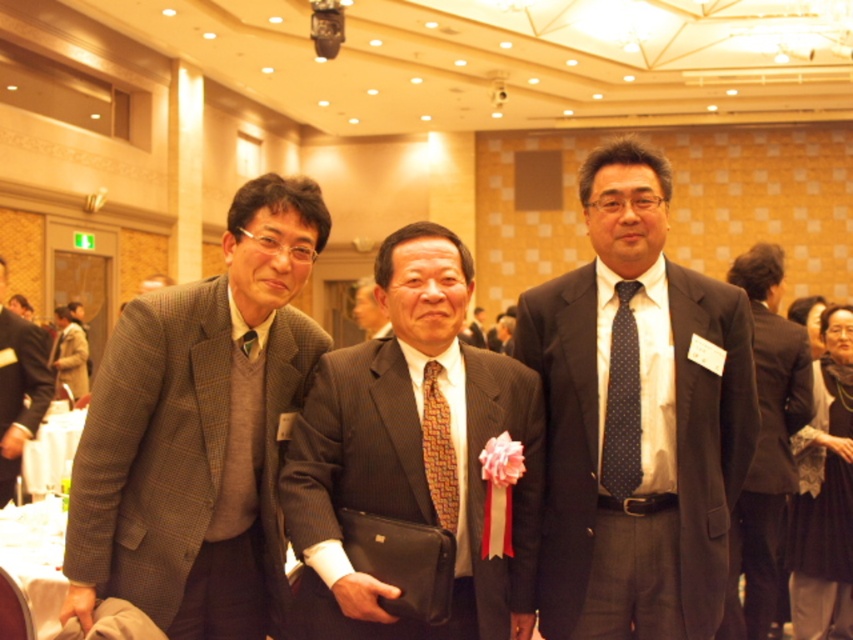
What are the coordinates of `brown pinstripe suit at center` in the screenshot? It's located at (413, 452).

Which is below, brown pinstripe suit at center or brown textured suit at center?

brown pinstripe suit at center is below.

The image size is (853, 640). I want to click on brown pinstripe suit at center, so click(x=413, y=452).

Between dark gray suit at center and dark blue dotted tie at center, which one is positioned lower?

dark blue dotted tie at center

Between dark gray suit at center and dark blue dotted tie at center, which one is positioned higher?

dark gray suit at center is higher up.

Measure the distance between dark gray suit at center and camera.

dark gray suit at center and camera are 2.32 meters apart.

The height and width of the screenshot is (640, 853). I want to click on dark gray suit at center, so click(636, 419).

Can you confirm if dark blue dotted tie at center is positioned above brown wool jacket at left?

Correct, dark blue dotted tie at center is located above brown wool jacket at left.

Who is more distant from viewer, (639, 401) or (57, 310)?

Point (57, 310)

Is point (616, 419) farther from camera compared to point (74, 339)?

No.

This screenshot has width=853, height=640. Identify the location of dark blue dotted tie at center. (622, 401).